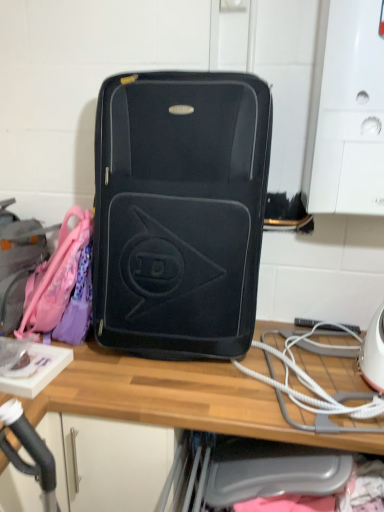
Find the location of `blank space to the left of white cord at lower right`. blank space to the left of white cord at lower right is located at coordinates 216,390.